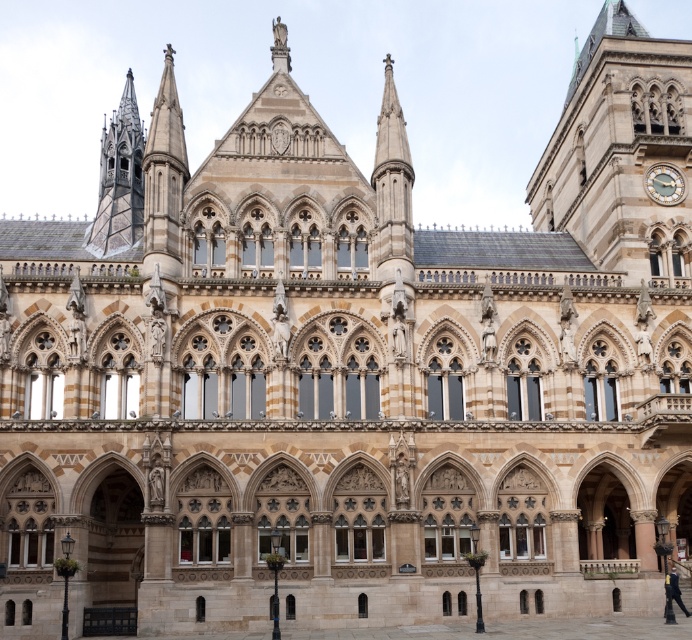
Consider the image. You are an architect reviewing the blueprint of the grand historic building. The blueprint shows a point labeled as point 1 at coordinates (619,150). Based on the image description, what architectural feature does this point most likely correspond to?

The point (619,150) corresponds to the golden stone clock tower at upper right.

You are standing at the entrance of the grand historic building and want to take a photo of the golden stone clock tower at upper right. If your camera can focus on objects up to 60 meters away, will you need to move closer to get a clear shot?

The golden stone clock tower at upper right is 66.87 meters away from the camera, which is beyond the camera focus range of 60 meters. Therefore, you need to move closer to ensure the golden stone clock tower at upper right is within the focus range.

You are an architect analyzing the building. You observe the golden stone clock tower at upper right and the gold metallic clock at upper right. Which of these two elements is taller?

The golden stone clock tower at upper right is taller than the gold metallic clock at upper right according to the description provided.